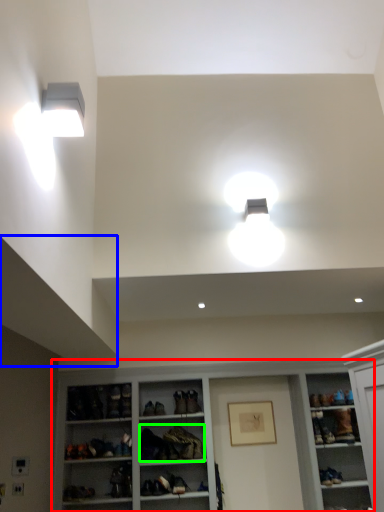
Question: Considering the real-world distances, which object is closest to shelf (highlighted by a red box)? exhaust hood (highlighted by a blue box) or clothing (highlighted by a green box).

Choices:
 (A) exhaust hood
 (B) clothing

Answer: (B)